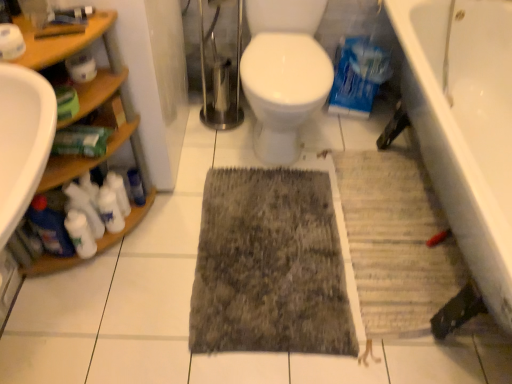
Find the location of a particular element. This screenshot has width=512, height=384. free spot behind dark gray textured rug at center is located at coordinates (296, 146).